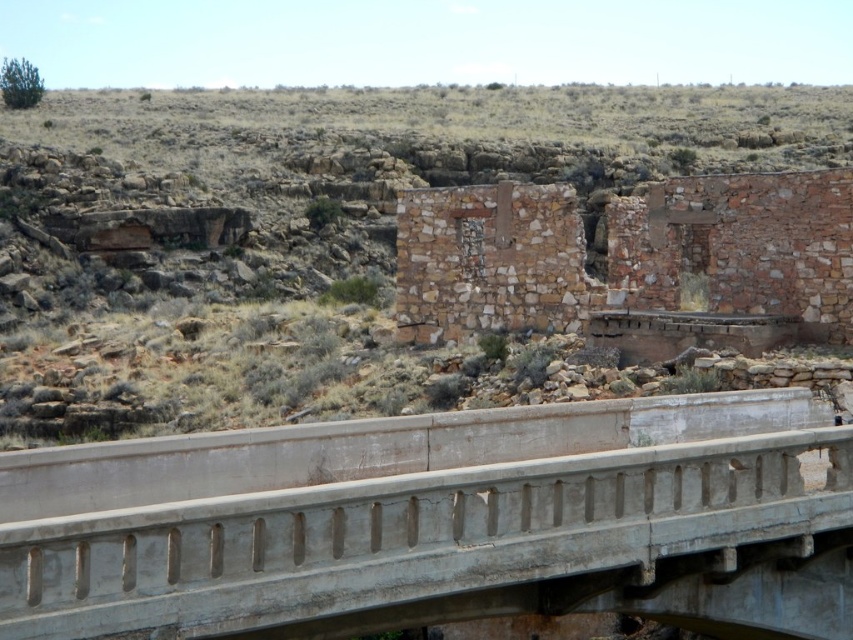
Question: Is concrete bridge at center thinner than brown stone ruins at center?

Choices:
 (A) no
 (B) yes

Answer: (A)

Question: Which of the following is the closest to the observer?

Choices:
 (A) (247, 449)
 (B) (503, 316)

Answer: (A)

Question: Does concrete bridge at center have a larger size compared to brown stone ruins at center?

Choices:
 (A) yes
 (B) no

Answer: (B)

Question: Does concrete bridge at center appear over brown stone ruins at center?

Choices:
 (A) no
 (B) yes

Answer: (A)